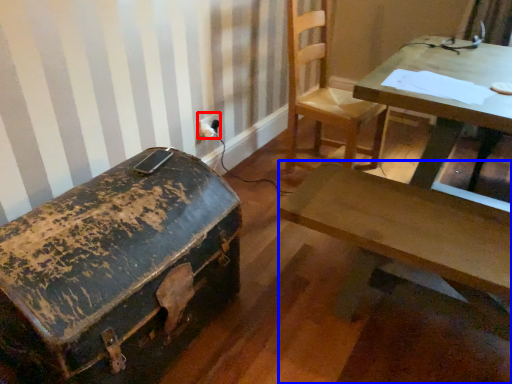
Question: Which object appears closest to the camera in this image, electric outlet (highlighted by a red box) or desk (highlighted by a blue box)?

Choices:
 (A) electric outlet
 (B) desk

Answer: (B)